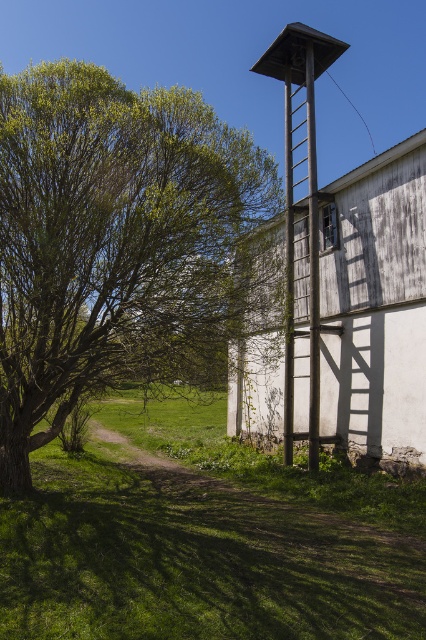
You are standing at the base of the weathered white building with the wooden structure. You notice a point marked at coordinates (111, 237). What object is located at that point?

The point at (111, 237) indicates a green leafy tree at left.